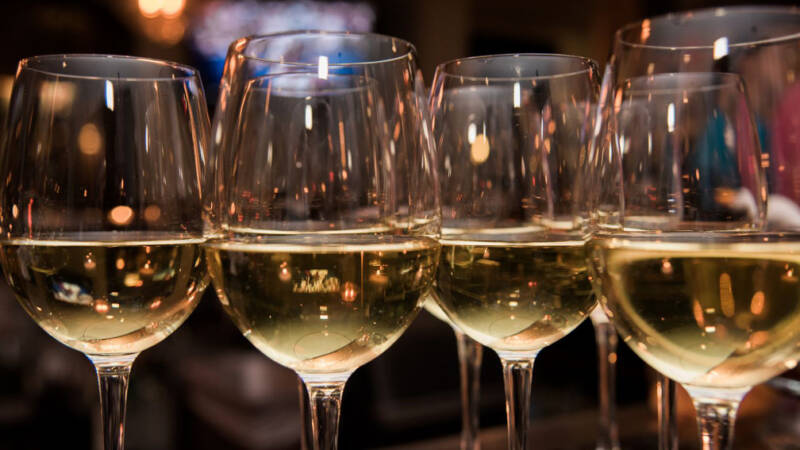
Where is `wine glasses`? The height and width of the screenshot is (450, 800). wine glasses is located at coordinates (686, 308), (477, 304), (337, 286), (130, 302).